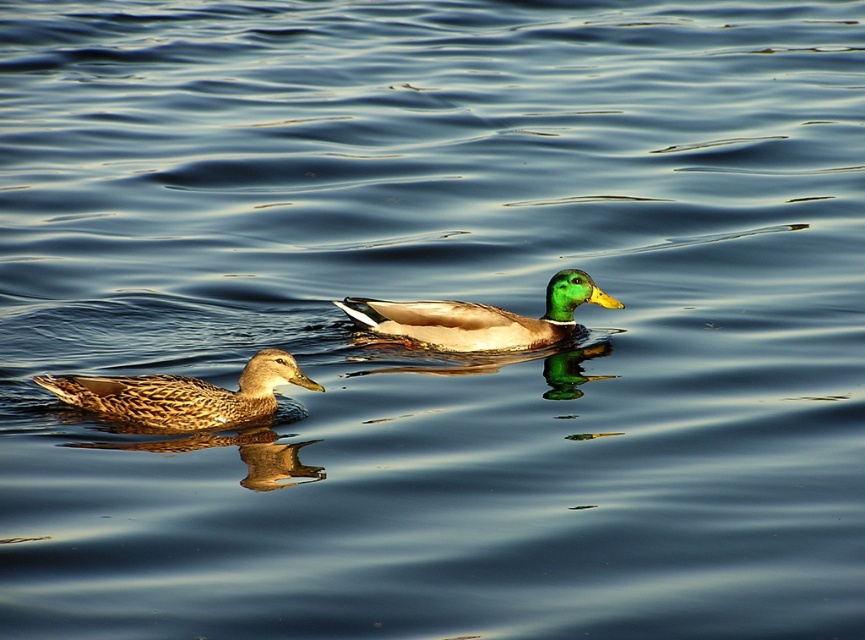
Image resolution: width=865 pixels, height=640 pixels. What do you see at coordinates (183, 394) in the screenshot?
I see `brown speckled feathers at left` at bounding box center [183, 394].

Is brown speckled feathers at left above green glossy duck at center?

Incorrect, brown speckled feathers at left is not positioned above green glossy duck at center.

Locate an element on the screen. This screenshot has width=865, height=640. brown speckled feathers at left is located at coordinates (183, 394).